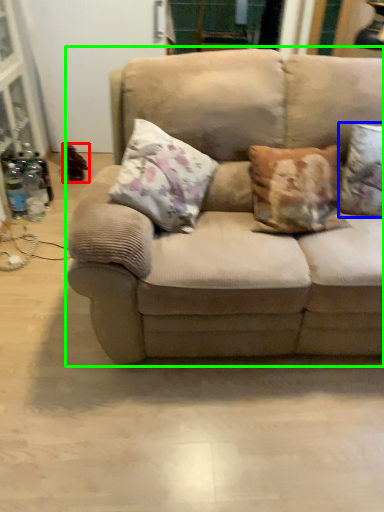
Question: Based on their relative distances, which object is farther from toy (highlighted by a red box)? Choose from pillow (highlighted by a blue box) and studio couch (highlighted by a green box).

Choices:
 (A) pillow
 (B) studio couch

Answer: (A)